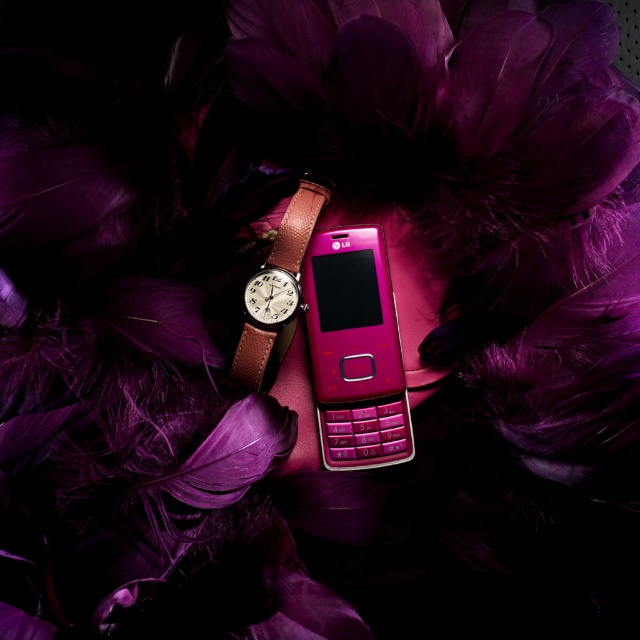
Question: Is pink glossy phone at center above leather strap at center?

Choices:
 (A) yes
 (B) no

Answer: (B)

Question: Is pink glossy phone at center closer to the viewer compared to leather strap at center?

Choices:
 (A) no
 (B) yes

Answer: (A)

Question: Which object appears closest to the camera in this image?

Choices:
 (A) pink glossy phone at center
 (B) leather strap at center

Answer: (B)

Question: Which point is closer to the camera?

Choices:
 (A) (298, 218)
 (B) (385, 250)

Answer: (A)

Question: Is pink glossy phone at center below leather strap at center?

Choices:
 (A) no
 (B) yes

Answer: (B)

Question: Which point is farther to the camera?

Choices:
 (A) pink glossy phone at center
 (B) leather strap at center

Answer: (A)